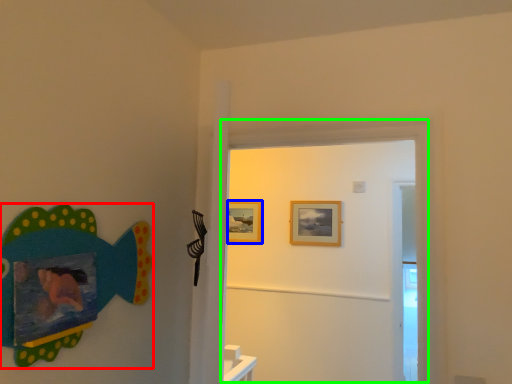
Question: Based on their relative distances, which object is nearer to fish (highlighted by a red box)? Choose from picture frame (highlighted by a blue box) and door (highlighted by a green box).

Choices:
 (A) picture frame
 (B) door

Answer: (B)